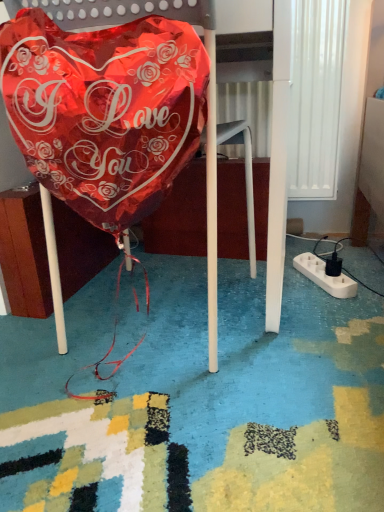
Where is `shiny metallic balloon at left`? This screenshot has width=384, height=512. shiny metallic balloon at left is located at coordinates (104, 110).

Locate an element on the screen. shiny metallic balloon at center is located at coordinates (208, 95).

From the image's perspective, who appears lower, shiny metallic balloon at center or white plastic extension cord at lower right?

white plastic extension cord at lower right is shown below in the image.

Which is closer, (192, 7) or (323, 285)?

Point (192, 7) is positioned closer to the camera compared to point (323, 285).

From a real-world perspective, is shiny metallic balloon at center positioned above or below white plastic extension cord at lower right?

Clearly, from a real-world perspective, shiny metallic balloon at center is above white plastic extension cord at lower right.

In the image, is shiny metallic balloon at center on the left side or the right side of white plastic extension cord at lower right?

In the image, shiny metallic balloon at center appears on the left side of white plastic extension cord at lower right.

Is white plastic extension cord at lower right thinner than shiny metallic balloon at left?

No.

Does white plastic extension cord at lower right turn towards shiny metallic balloon at left?

No, white plastic extension cord at lower right is not oriented towards shiny metallic balloon at left.

From the image's perspective, is white plastic extension cord at lower right over shiny metallic balloon at left?

No, from the image's perspective, white plastic extension cord at lower right is not on top of shiny metallic balloon at left.

Is shiny metallic balloon at left surrounding shiny metallic balloon at center?

No, shiny metallic balloon at center is not surrounded by shiny metallic balloon at left.

Is point (171, 69) farther from camera compared to point (205, 42)?

No, (171, 69) is closer to viewer.

Which is more to the left, shiny metallic balloon at left or shiny metallic balloon at center?

From the viewer's perspective, shiny metallic balloon at left appears more on the left side.

Is shiny metallic balloon at center not within shiny metallic balloon at left?

Yes, shiny metallic balloon at center is not within shiny metallic balloon at left.

Is shiny metallic balloon at center at the left side of shiny metallic balloon at left?

Incorrect, shiny metallic balloon at center is not on the left side of shiny metallic balloon at left.

Looking at this image, from a real-world perspective, is shiny metallic balloon at center positioned above or below shiny metallic balloon at left?

shiny metallic balloon at center is above shiny metallic balloon at left.

Where is `blanket in front of the shiny metallic balloon at center`? blanket in front of the shiny metallic balloon at center is located at coordinates (104, 110).

Is white plastic extension cord at lower right thinner than shiny metallic balloon at center?

Indeed, white plastic extension cord at lower right has a lesser width compared to shiny metallic balloon at center.

Looking at this image, is white plastic extension cord at lower right not within shiny metallic balloon at center?

That's correct, white plastic extension cord at lower right is outside of shiny metallic balloon at center.

Is white plastic extension cord at lower right with shiny metallic balloon at center?

No.

Identify the location of extension cord below the shiny metallic balloon at left (from a real-world perspective). (325, 276).

Between shiny metallic balloon at left and white plastic extension cord at lower right, which one is positioned in front?

Positioned in front is shiny metallic balloon at left.

Is shiny metallic balloon at left positioned with its back to white plastic extension cord at lower right?

No.

Where is `extension cord on the right of shiny metallic balloon at center`? Image resolution: width=384 pixels, height=512 pixels. extension cord on the right of shiny metallic balloon at center is located at coordinates (325, 276).

The width and height of the screenshot is (384, 512). In order to click on blanket located above the white plastic extension cord at lower right (from a real-world perspective) in this screenshot , I will do `click(104, 110)`.

Based on their spatial positions, is shiny metallic balloon at center or white plastic extension cord at lower right closer to shiny metallic balloon at left?

shiny metallic balloon at center lies closer to shiny metallic balloon at left than the other object.

Based on their spatial positions, is shiny metallic balloon at left or white plastic extension cord at lower right further from shiny metallic balloon at center?

The object further to shiny metallic balloon at center is white plastic extension cord at lower right.

Which object lies further to the anchor point shiny metallic balloon at center, white plastic extension cord at lower right or shiny metallic balloon at left?

The object further to shiny metallic balloon at center is white plastic extension cord at lower right.

Considering their positions, is white plastic extension cord at lower right positioned closer to shiny metallic balloon at left than shiny metallic balloon at center?

Among the two, shiny metallic balloon at center is located nearer to shiny metallic balloon at left.

From the image, which object appears to be farther from white plastic extension cord at lower right, shiny metallic balloon at left or shiny metallic balloon at center?

The object further to white plastic extension cord at lower right is shiny metallic balloon at left.

Based on their spatial positions, is shiny metallic balloon at center or shiny metallic balloon at left closer to white plastic extension cord at lower right?

Among the two, shiny metallic balloon at center is located nearer to white plastic extension cord at lower right.

The height and width of the screenshot is (512, 384). In order to click on furniture located between shiny metallic balloon at left and white plastic extension cord at lower right in the left-right direction in this screenshot , I will do `click(208, 95)`.